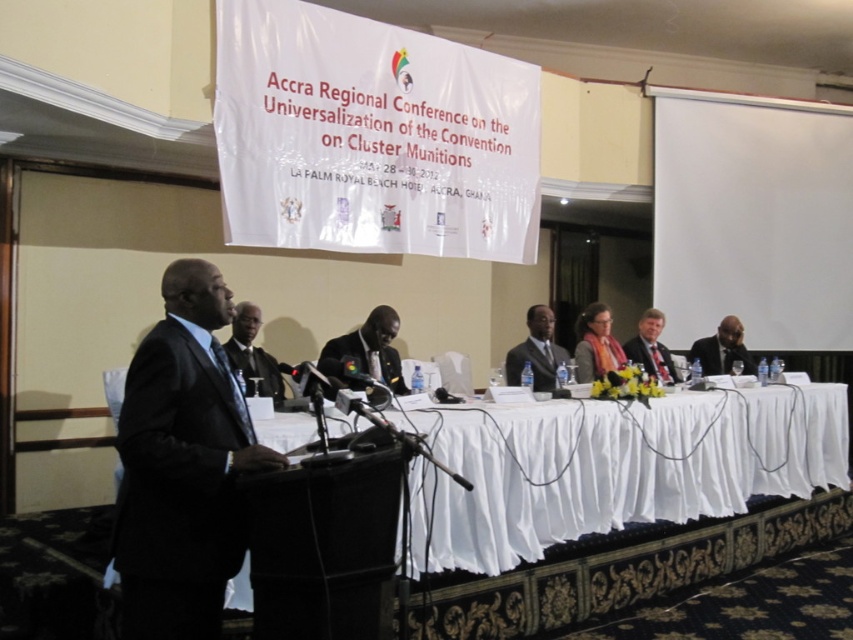
You are an event photographer at the Accra Regional Conference. You need to capture a photo of both the dark gray matte suit at center and the dark gray suit at center. Which one should you focus on first to ensure both are in the frame?

The dark gray matte suit at center is in front of the dark gray suit at center, so you should focus on the dark gray suit at center first to ensure both are in the frame.